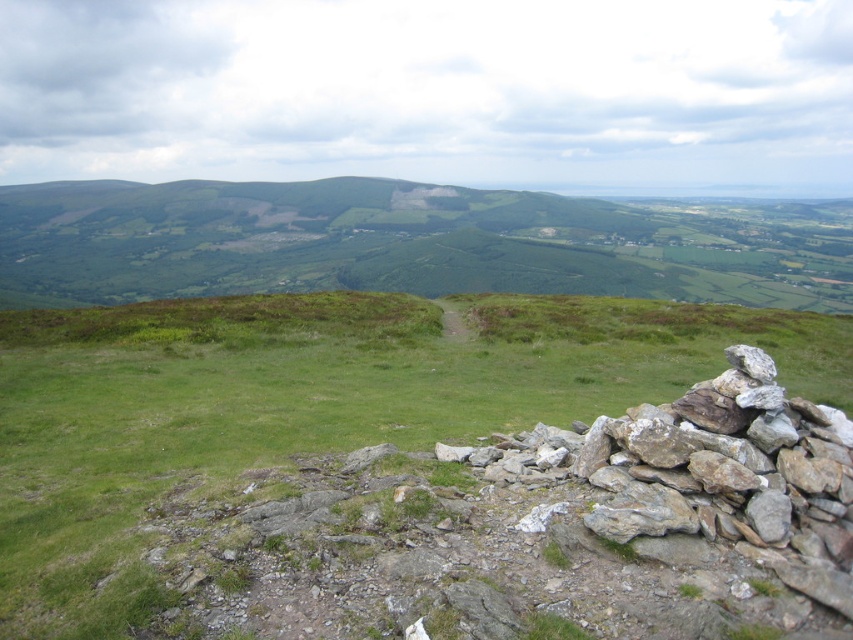
Based on the photo, measure the distance between green grassy at center and camera.

They are 5.99 meters apart.

Is green grassy at center behind green grassy hillside at center?

No, it is in front of green grassy hillside at center.

Locate an element on the screen. The height and width of the screenshot is (640, 853). green grassy at center is located at coordinates (364, 470).